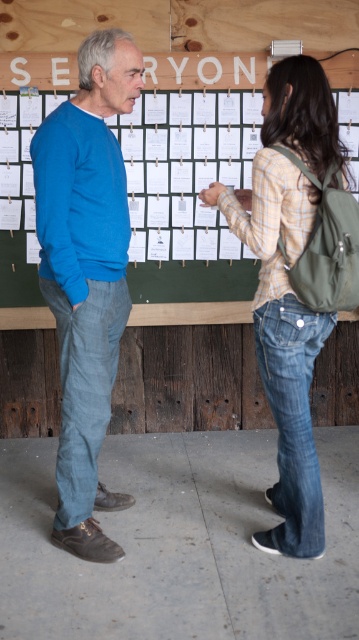
Measure the distance between blue cotton sweater at left and camera.

blue cotton sweater at left and camera are 7.14 feet apart.

Does blue cotton sweater at left appear on the right side of denim jeans at left?

Indeed, blue cotton sweater at left is positioned on the right side of denim jeans at left.

Between point (115, 220) and point (104, 412), which one is positioned in front?

Point (115, 220) is in front.

Image resolution: width=359 pixels, height=640 pixels. Identify the location of blue cotton sweater at left. (86, 275).

Does point (258, 352) lie in front of point (61, 358)?

Yes, it is in front of point (61, 358).

Who is taller, denim jeans at lower right or denim jeans at left?

Standing taller between the two is denim jeans at left.

Identify the location of denim jeans at lower right. This screenshot has width=359, height=640. (291, 420).

Does green fabric bulletin board at upper center appear on the left side of blue cotton sweater at left?

No, green fabric bulletin board at upper center is not to the left of blue cotton sweater at left.

Is green fabric bulletin board at upper center wider than blue cotton sweater at left?

Yes, green fabric bulletin board at upper center is wider than blue cotton sweater at left.

Is point (152, 76) positioned after point (103, 326)?

Yes, it is.

The width and height of the screenshot is (359, 640). Find the location of `green fabric bulletin board at upper center`. green fabric bulletin board at upper center is located at coordinates (189, 173).